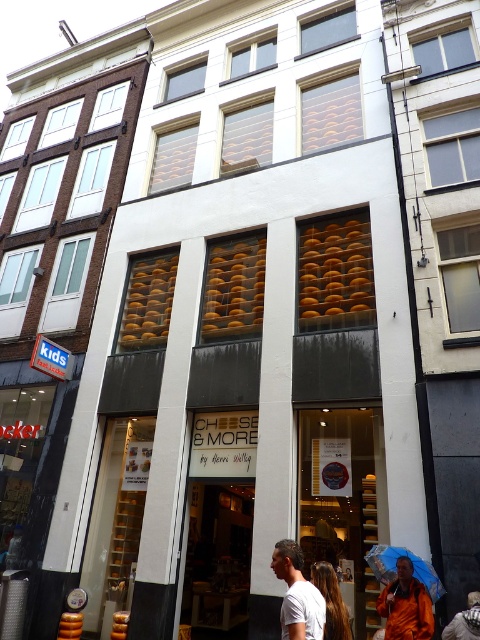
Is white matte t-shirt at center shorter than orange fabric umbrella at center?

Yes.

Who is positioned more to the left, white matte t-shirt at center or orange fabric umbrella at center?

white matte t-shirt at center

Is point (312, 593) farther from viewer compared to point (381, 598)?

No, it is in front of (381, 598).

Locate an element on the screen. This screenshot has height=640, width=480. white matte t-shirt at center is located at coordinates (297, 595).

Which of these two, white matte t-shirt at center or blue fabric umbrella at lower center, stands shorter?

blue fabric umbrella at lower center is shorter.

Locate an element on the screen. Image resolution: width=480 pixels, height=640 pixels. white matte t-shirt at center is located at coordinates (297, 595).

You are a GUI agent. You are given a task and a screenshot of the screen. Output one action in this format:
    pyautogui.click(x=<x>, y=<y>)
    Task: Click on the white matte t-shirt at center
    
    Given the screenshot: What is the action you would take?
    pyautogui.click(x=297, y=595)

Locate an element on the screen. This screenshot has height=640, width=480. white matte t-shirt at center is located at coordinates (297, 595).

At what (x,y) coordinates should I click in order to perform the action: click on orange fabric umbrella at center. Please return your answer as a coordinate pair (x, y). The image size is (480, 640). Looking at the image, I should click on (406, 605).

Which is above, orange fabric umbrella at center or blue fabric umbrella at lower center?

blue fabric umbrella at lower center is higher up.

Who is more forward, (400, 602) or (433, 595)?

Point (400, 602) is more forward.

The image size is (480, 640). What are the coordinates of `orange fabric umbrella at center` in the screenshot? It's located at (406, 605).